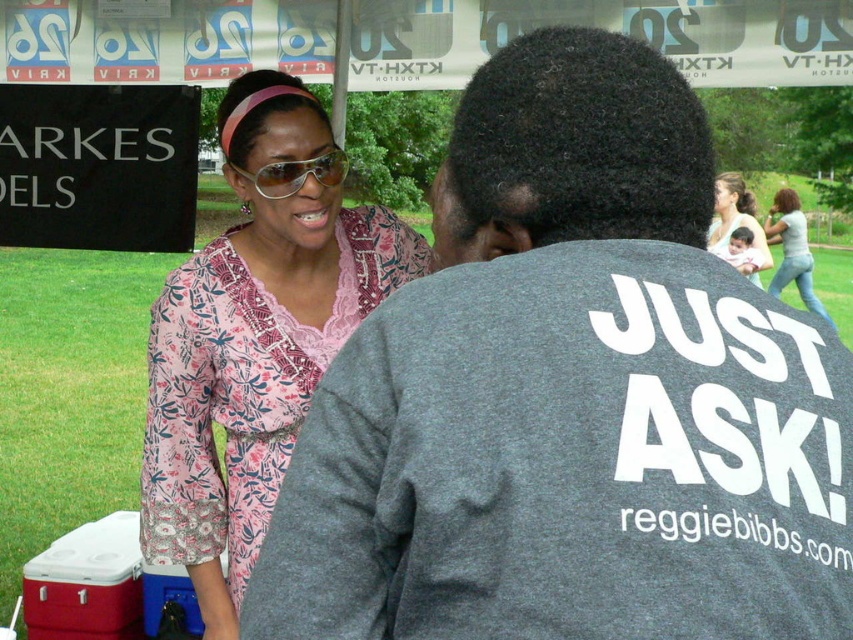
What is the position of the point with coordinates (570, 397) in the image?

The point with coordinates (570, 397) is located on the gray cotton t shirt at center.

You are at a community event and see the floral fabric dress at upper left and sunglasses at center. Which one is positioned lower in the image?

The floral fabric dress at upper left is below sunglasses at center, so it is positioned lower.